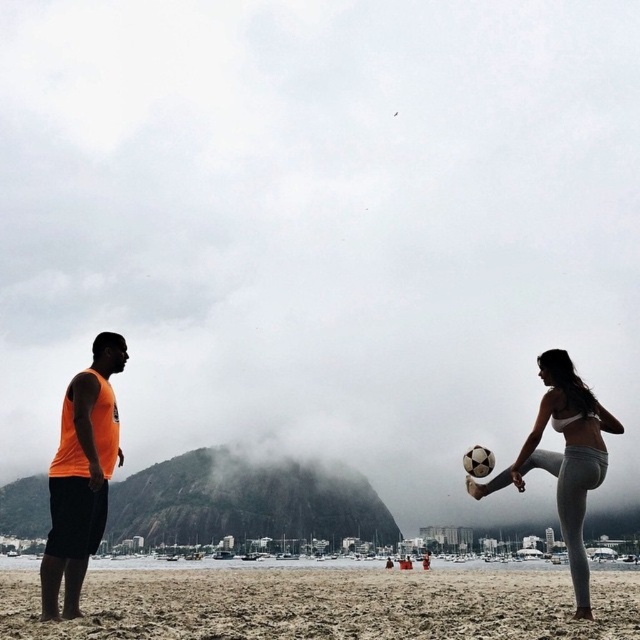
Question: Is brown sand at lower center further to the viewer compared to white matte bikini at center?

Choices:
 (A) no
 (B) yes

Answer: (A)

Question: Which object is closer to the camera taking this photo?

Choices:
 (A) orange sleeveless shirt at left
 (B) white matte bikini at center

Answer: (A)

Question: Which point is farther from the camera taking this photo?

Choices:
 (A) (476, 579)
 (B) (577, 563)

Answer: (A)

Question: Is the position of orange sleeveless shirt at left less distant than that of white matte bikini at center?

Choices:
 (A) yes
 (B) no

Answer: (A)

Question: Which object is the farthest from the white matte bikini at center?

Choices:
 (A) orange sleeveless shirt at left
 (B) brown sand at lower center

Answer: (A)

Question: Does orange sleeveless shirt at left appear over white matte bikini at center?

Choices:
 (A) no
 (B) yes

Answer: (A)